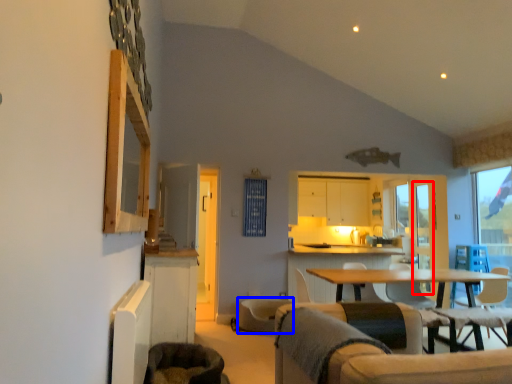
Question: Which of the following is the farthest to the observer, screen door (highlighted by a red box) or swivel chair (highlighted by a blue box)?

Choices:
 (A) screen door
 (B) swivel chair

Answer: (A)